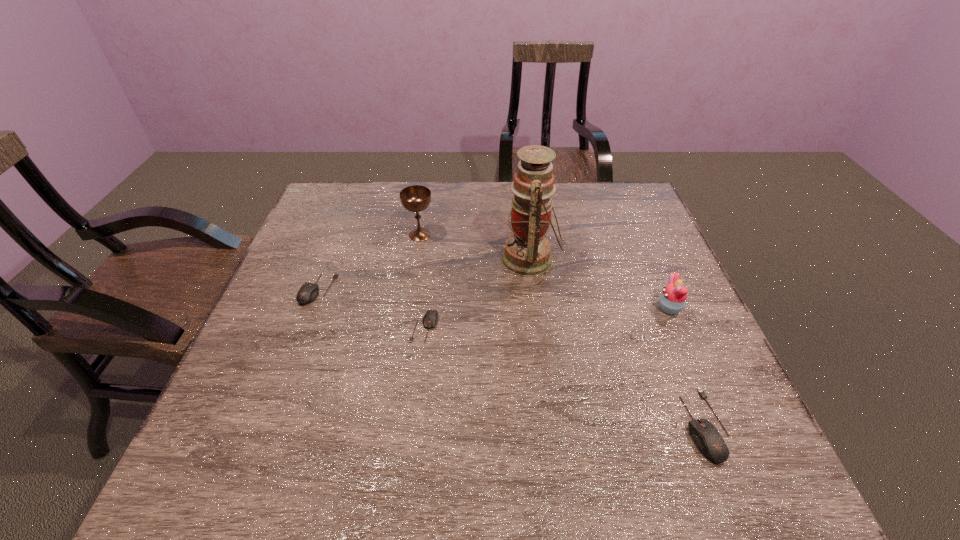
Identify which object is located as the third nearest to the cupcake. Please provide its 2D coordinates. Your answer should be formatted as a tuple, i.e. [(x, y)], where the tuple contains the x and y coordinates of a point satisfying the conditions above.

[(430, 318)]

Find the location of a particular element. Image resolution: width=960 pixels, height=540 pixels. mouse that is the second closest to the leftmost object is located at coordinates (707, 438).

Image resolution: width=960 pixels, height=540 pixels. In order to click on the second closest mouse to the fifth shortest object in this screenshot , I will do `click(430, 318)`.

What are the coordinates of `free space that satisfies the following two spatial constraints: 1. on the back side of the second tallest object; 2. on the left side of the leftmost object` in the screenshot? It's located at (339, 235).